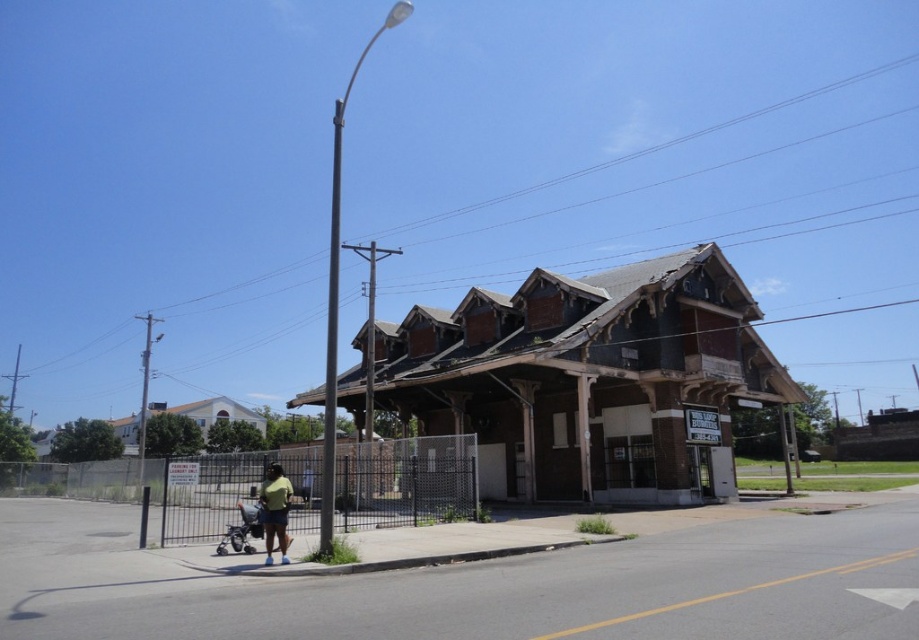
Question: Where is smooth gray pole at center located in relation to green matte shirt at lower center in the image?

Choices:
 (A) below
 (B) above

Answer: (B)

Question: In this image, where is green matte shirt at lower center located relative to silver metallic stroller at lower left?

Choices:
 (A) above
 (B) below

Answer: (A)

Question: Which of the following is the farthest from the observer?

Choices:
 (A) silver metallic stroller at lower left
 (B) green matte shirt at lower center

Answer: (A)

Question: Is smooth gray pole at center further to the viewer compared to green matte shirt at lower center?

Choices:
 (A) no
 (B) yes

Answer: (B)

Question: Among these objects, which one is farthest from the camera?

Choices:
 (A) smooth gray pole at center
 (B) green matte shirt at lower center

Answer: (A)

Question: Which of the following is the farthest from the observer?

Choices:
 (A) (273, 534)
 (B) (331, 516)
 (C) (231, 529)

Answer: (C)